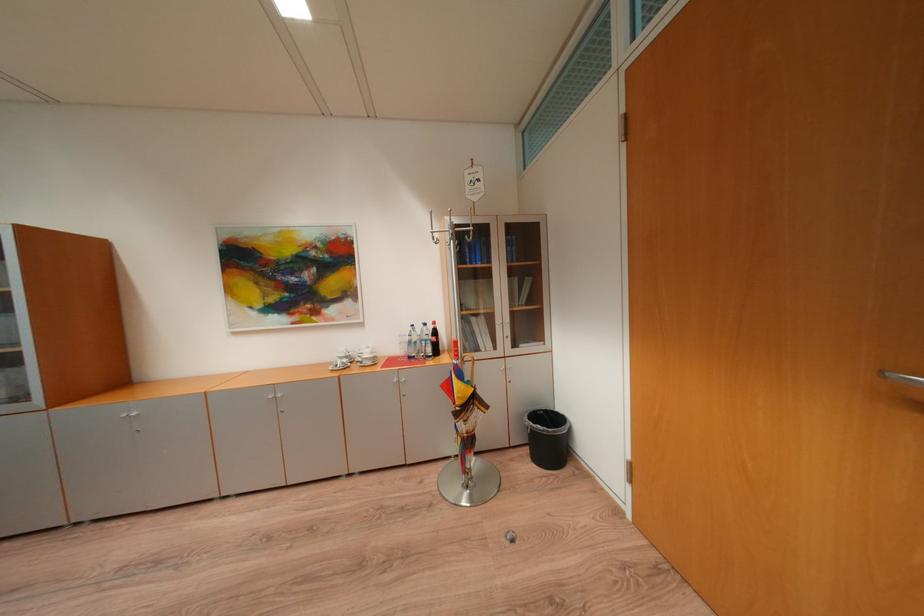
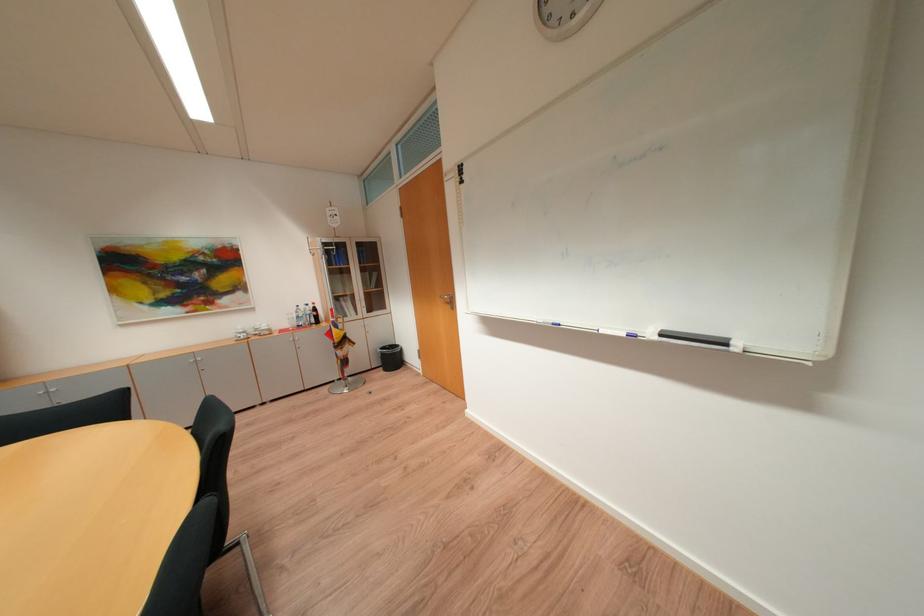
Find the pixel in the second image that matches [419,344] in the first image.

(307, 318)